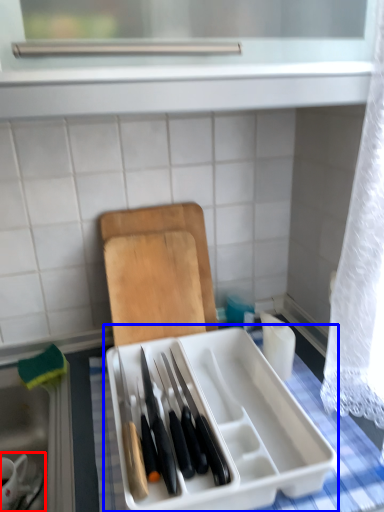
Question: Which object appears closest to the camera in this image, tableware (highlighted by a red box) or appliance (highlighted by a blue box)?

Choices:
 (A) tableware
 (B) appliance

Answer: (B)